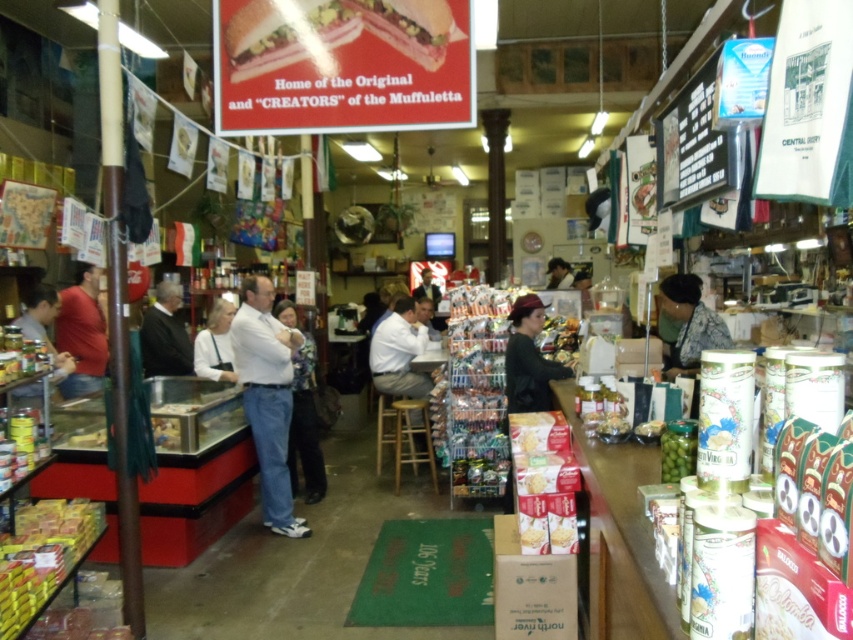
Is light blue jeans at center smaller than black sweater at center?

Incorrect, light blue jeans at center is not smaller in size than black sweater at center.

Between point (300, 388) and point (171, 312), which one is positioned in front?

Point (300, 388) is more forward.

The width and height of the screenshot is (853, 640). I want to click on light blue jeans at center, so click(x=305, y=426).

Based on the photo, does white cotton shirt at center have a larger size compared to light brown leather jacket at center?

Incorrect, white cotton shirt at center is not larger than light brown leather jacket at center.

Consider the image. Is white cotton shirt at center positioned in front of light brown leather jacket at center?

Yes.

Is point (238, 321) in front of point (384, 364)?

Yes.

Locate an element on the screen. Image resolution: width=853 pixels, height=640 pixels. white cotton shirt at center is located at coordinates (267, 396).

From the picture: Who is positioned more to the right, matte red shirt at left or floral-patterned shirt at center?

floral-patterned shirt at center

Is point (80, 378) positioned before point (683, 352)?

No, (80, 378) is further to viewer.

At what (x,y) coordinates should I click in order to perform the action: click on matte red shirt at left. Please return your answer as a coordinate pair (x, y). This screenshot has width=853, height=640. Looking at the image, I should click on (82, 332).